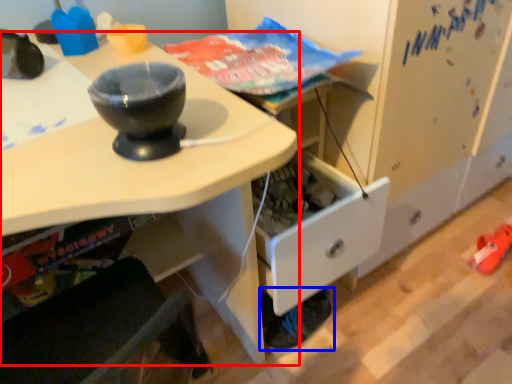
Question: Which object is closer to the camera taking this photo, desk (highlighted by a red box) or footwear (highlighted by a blue box)?

Choices:
 (A) desk
 (B) footwear

Answer: (A)